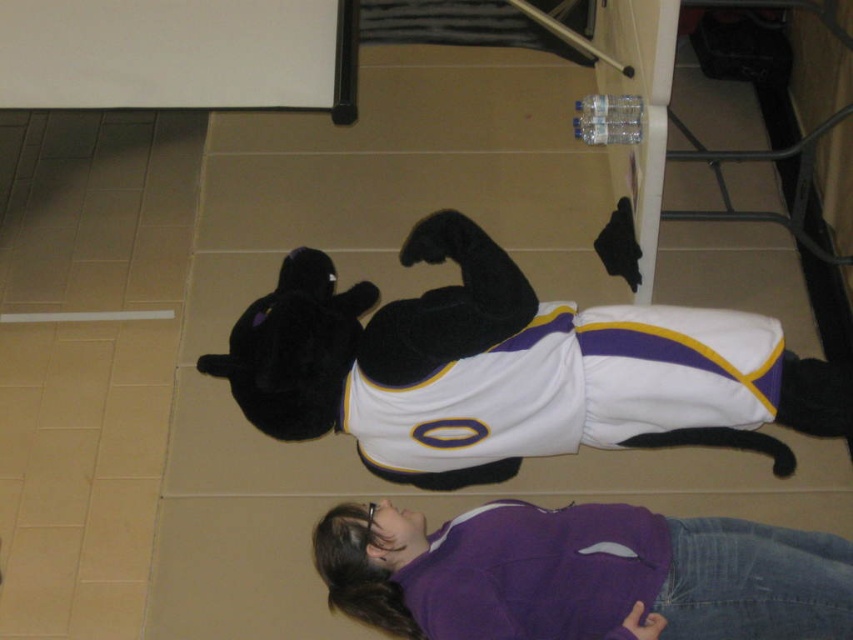
Question: Which object appears closest to the camera in this image?

Choices:
 (A) purple fleece jacket at lower center
 (B) black plush toy at center

Answer: (A)

Question: Which point appears farthest from the camera in this image?

Choices:
 (A) (711, 604)
 (B) (844, 372)

Answer: (B)

Question: In this image, where is black plush toy at center located relative to purple fleece jacket at lower center?

Choices:
 (A) left
 (B) right

Answer: (A)

Question: Can you confirm if black plush toy at center is wider than purple fleece jacket at lower center?

Choices:
 (A) no
 (B) yes

Answer: (B)

Question: Does black plush toy at center come behind purple fleece jacket at lower center?

Choices:
 (A) yes
 (B) no

Answer: (A)